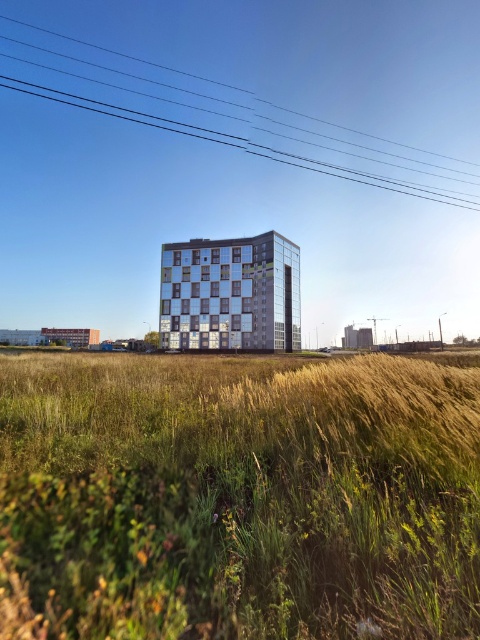
You are a landscape architect designing a garden for this building. You need to know which area is smaller in size between the green grass at center and the clear wire at upper center. Which one should you consider for a small decorative feature?

The green grass at center occupies less space than the clear wire at upper center, so you should consider placing the small decorative feature on the green grass at center.

In the scene shown: You are standing in front of the modern building and notice the green grass at center and the clear wire at upper center. Which object is located higher in the image?

The clear wire at upper center is higher because the green grass at center is below it.